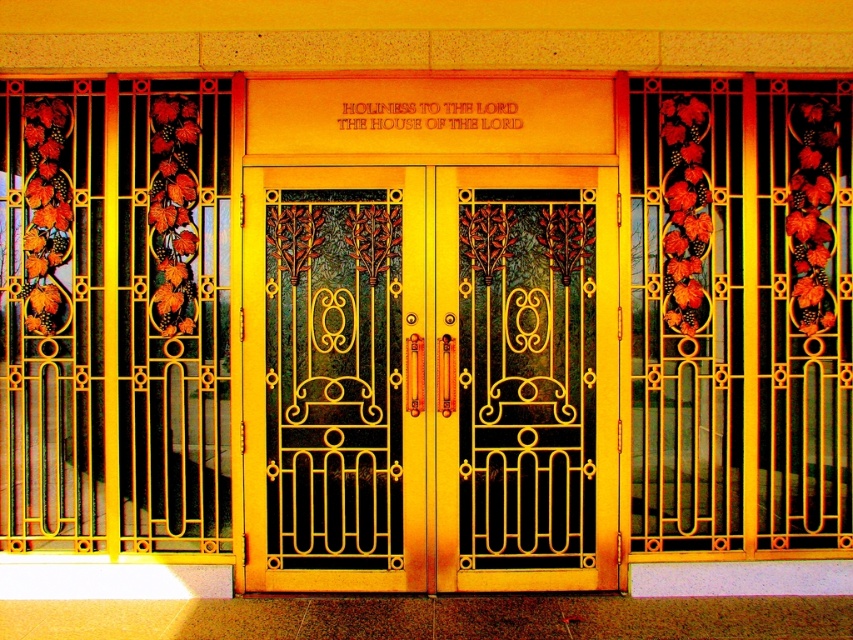
You are standing in front of the gold polished metal doors at center. You want to touch them. Considering your height is 1.70 meters, can you reach the top of the doors without any assistance?

The gold polished metal doors at center are 5.30 meters away from you. Since the distance is measured from your position to the doors, your ability to reach the top depends on the doors height, which isn t provided. However, the question mentions your height, so perhaps the doors are taller than you. Without specific height info, it s impossible to determine.

You are an architect designing a new building and need to ensure there is enough space between the gold polished metal doors at center and the gold textured door at center for a 15 cm wide decorative panel. Based on the image, will the space between them accommodate the panel?

The distance between the gold polished metal doors at center and the gold textured door at center is 17.02 centimeters, which is wider than the 15 cm panel. Therefore, the space can accommodate the decorative panel.

You are an architect designing a new entrance for a museum. You have two doors to place in the center of the entrance. The gold polished metal doors at center and the gold textured screen door at center. According to the design, the screen door must be taller than the main doors. Does the current arrangement meet the design requirement?

The gold polished metal doors at center is shorter than gold textured screen door at center, so the current arrangement meets the design requirement since the screen door is taller than the main doors.